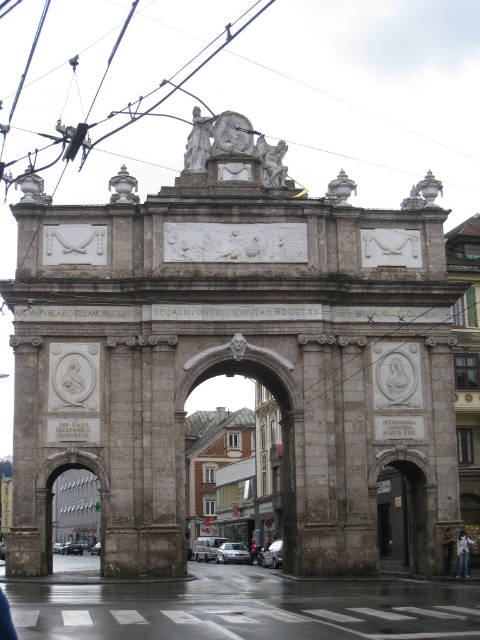
You are an art student standing in front of the archway. You notice the white marble statue at upper center and the blurred fabric person at center. Which object is closer to you?

The white marble statue at upper center is closer to you than the blurred fabric person at center.

You are standing in the square and want to take a photo of the gray stone archway at center. If you are using a camera with a 50mm lens, which is set to focus at 10 meters, will the archway be in focus if it is located at 10 meters away from you? Assume the hyperfocal distance is 8 meters.

The hyperfocal distance is 8 meters, so focusing at 10 meters may not ensure the gray stone archway at center is in focus. To achieve sharpness, you should focus at the hyperfocal distance of 8 meters instead of 10 meters.